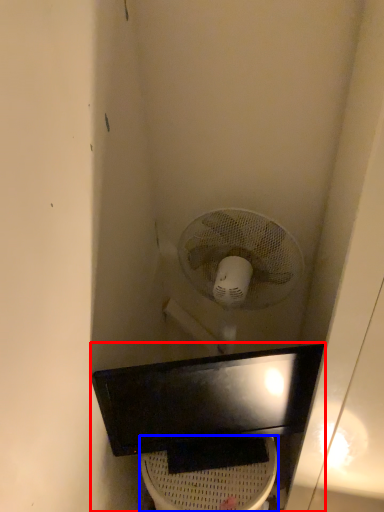
Question: Which object appears farthest to the camera in this image, sink (highlighted by a red box) or toilet bowl (highlighted by a blue box)?

Choices:
 (A) sink
 (B) toilet bowl

Answer: (B)